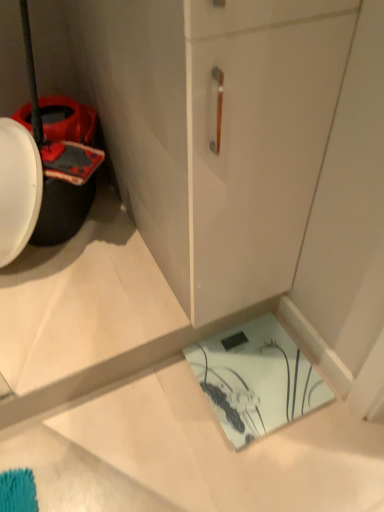
This screenshot has height=512, width=384. Describe the element at coordinates (256, 379) in the screenshot. I see `transparent glass scale at lower center` at that location.

You are a GUI agent. You are given a task and a screenshot of the screen. Output one action in this format:
    pyautogui.click(x=<x>, y=<y>)
    Task: Click on the transparent glass scale at lower center
    This screenshot has width=384, height=512.
    Given the screenshot: What is the action you would take?
    pyautogui.click(x=256, y=379)

This screenshot has width=384, height=512. I want to click on transparent glass scale at lower center, so pyautogui.click(x=256, y=379).